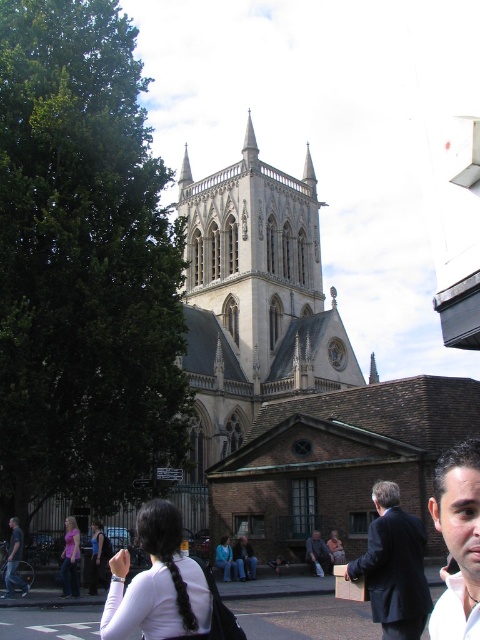
You are a photographer planning to take a group photo of the matte black suit at center and the dark blue jeans at lower left. Which of the two should you position closer to the camera to ensure both appear equally wide in the photo?

You should position the dark blue jeans at lower left closer to the camera because the matte black suit at center is wider in real life, so moving the narrower dark blue jeans at lower left forward will balance their apparent widths.

You are a tour guide leading a group near the historic cathedral. You notice a tourist wearing a matte black suit at center and another tourist wearing dark blue jeans at lower left. You need to inform them that they are exactly 91.57 feet apart. How would you phrase this in a way that uses their clothing as landmarks?

The tourist in the matte black suit at center is 91.57 feet away from the tourist in the dark blue jeans at lower left.